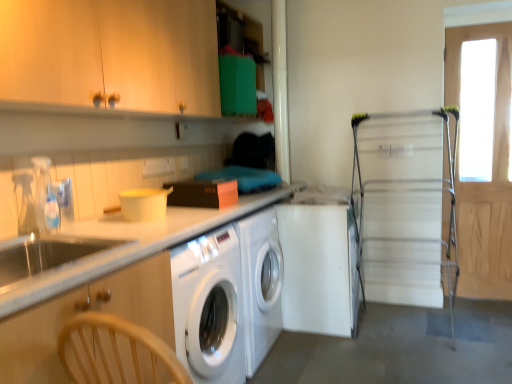
Where is `vacant space underneath metallic silver drying rack at right, which appears as the second screen door when viewed from the right (from a real-world perspective)`? This screenshot has width=512, height=384. vacant space underneath metallic silver drying rack at right, which appears as the second screen door when viewed from the right (from a real-world perspective) is located at coordinates (402, 328).